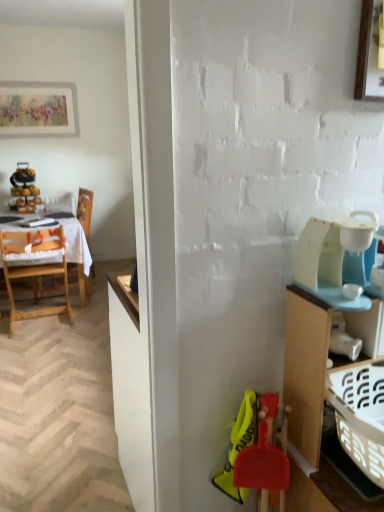
Question: Is matte white picture frame at upper left, marked as the 1th picture frame in a back-to-front arrangement, closer to the viewer compared to wooden picture frame at upper right, the 1th picture frame positioned from the right?

Choices:
 (A) yes
 (B) no

Answer: (B)

Question: Considering the relative sizes of matte white picture frame at upper left, arranged as the second picture frame when viewed from the front, and wooden picture frame at upper right, the 1th picture frame positioned from the right, in the image provided, is matte white picture frame at upper left, arranged as the second picture frame when viewed from the front, bigger than wooden picture frame at upper right, the 1th picture frame positioned from the right,?

Choices:
 (A) yes
 (B) no

Answer: (A)

Question: Are matte white picture frame at upper left, the 2th picture frame positioned from the bottom, and wooden picture frame at upper right, the 1th picture frame positioned from the right, far apart?

Choices:
 (A) yes
 (B) no

Answer: (A)

Question: Considering the relative sizes of matte white picture frame at upper left, which ranks as the first picture frame in top-to-bottom order, and wooden picture frame at upper right, arranged as the 2th picture frame when viewed from the back, in the image provided, is matte white picture frame at upper left, which ranks as the first picture frame in top-to-bottom order, shorter than wooden picture frame at upper right, arranged as the 2th picture frame when viewed from the back,?

Choices:
 (A) yes
 (B) no

Answer: (B)

Question: Are matte white picture frame at upper left, the 2th picture frame positioned from the bottom, and wooden picture frame at upper right, arranged as the first picture frame when ordered from the bottom, beside each other?

Choices:
 (A) no
 (B) yes

Answer: (A)

Question: From a real-world perspective, is matte white picture frame at upper left, the 2th picture frame from the right, on top of wooden picture frame at upper right, the 1th picture frame positioned from the right?

Choices:
 (A) no
 (B) yes

Answer: (A)

Question: Is white cloth at left bigger than white plastic coffee maker at right?

Choices:
 (A) yes
 (B) no

Answer: (A)

Question: Is white cloth at left taller than white plastic coffee maker at right?

Choices:
 (A) yes
 (B) no

Answer: (A)

Question: Is white cloth at left at the right side of white plastic coffee maker at right?

Choices:
 (A) no
 (B) yes

Answer: (A)

Question: From the image's perspective, is white cloth at left on top of white plastic coffee maker at right?

Choices:
 (A) no
 (B) yes

Answer: (B)

Question: Is white cloth at left next to white plastic coffee maker at right and touching it?

Choices:
 (A) yes
 (B) no

Answer: (B)

Question: Does white cloth at left have a smaller size compared to white plastic coffee maker at right?

Choices:
 (A) yes
 (B) no

Answer: (B)

Question: Is wooden chair at left, which is the second chair in front-to-back order, completely or partially outside of white plastic coffee maker at right?

Choices:
 (A) yes
 (B) no

Answer: (A)